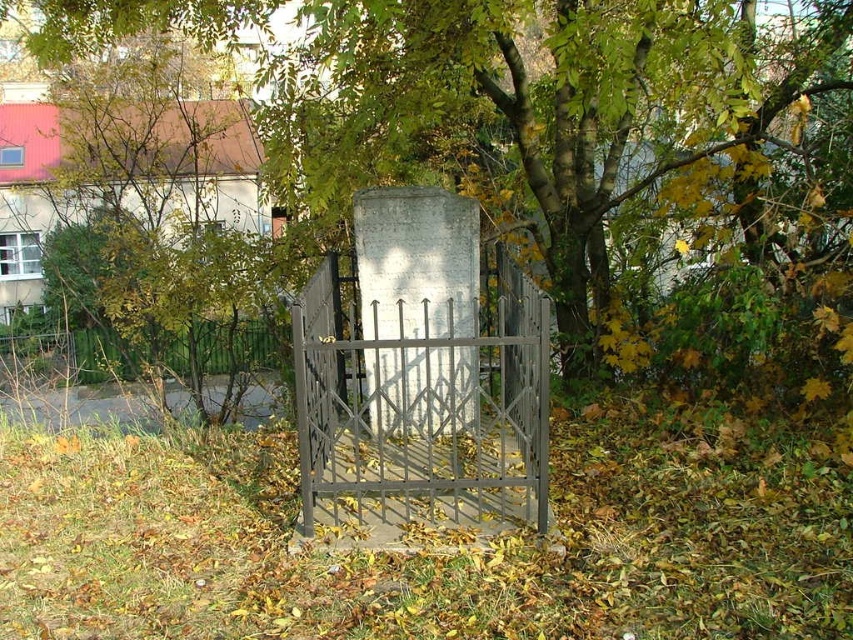
Image resolution: width=853 pixels, height=640 pixels. I want to click on green leafy tree at center, so click(596, 145).

I want to click on green leafy tree at center, so [596, 145].